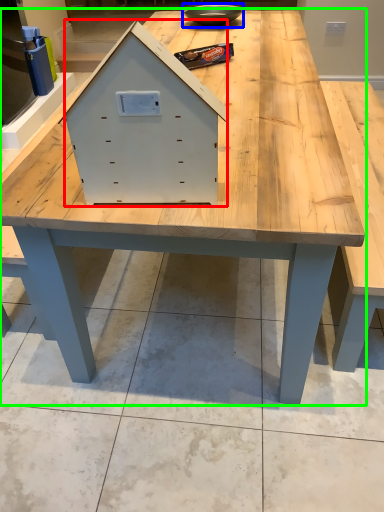
Question: Which object is the farthest from drawer (highlighted by a red box)? Choose among these: bowl (highlighted by a blue box) or table (highlighted by a green box).

Choices:
 (A) bowl
 (B) table

Answer: (A)